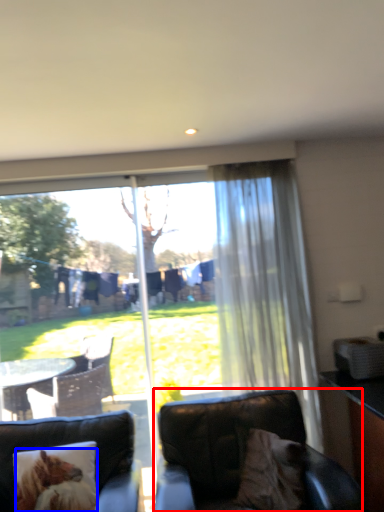
Question: Which point is closer to the camera, chair (highlighted by a red box) or animal (highlighted by a blue box)?

Choices:
 (A) chair
 (B) animal

Answer: (A)